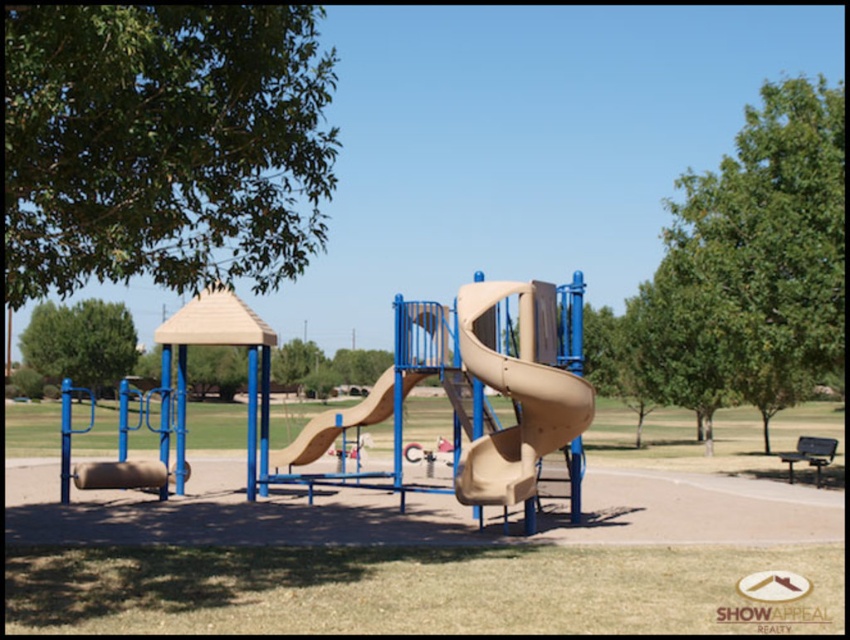
Image resolution: width=850 pixels, height=640 pixels. Describe the element at coordinates (516, 392) in the screenshot. I see `beige matte slide at center` at that location.

Is point (547, 365) closer to viewer compared to point (289, 465)?

Yes.

What are the coordinates of `beige matte slide at center` in the screenshot? It's located at (516, 392).

Measure the distance between point (190, 291) and camera.

Point (190, 291) and camera are 35.69 meters apart.

Is green leafy tree at upper left to the right of green leafy tree at upper right from the viewer's perspective?

Incorrect, green leafy tree at upper left is not on the right side of green leafy tree at upper right.

Between point (276, 211) and point (837, 172), which one is positioned in front?

Point (276, 211) is more forward.

Where is `green leafy tree at upper left`? green leafy tree at upper left is located at coordinates (163, 145).

Can you confirm if green leafy tree at upper right is positioned to the right of green leafy tree at left?

Correct, you'll find green leafy tree at upper right to the right of green leafy tree at left.

Does green leafy tree at upper right have a larger size compared to green leafy tree at left?

Yes.

This screenshot has height=640, width=850. Describe the element at coordinates (754, 262) in the screenshot. I see `green leafy tree at upper right` at that location.

Locate an element on the screen. green leafy tree at upper right is located at coordinates (754, 262).